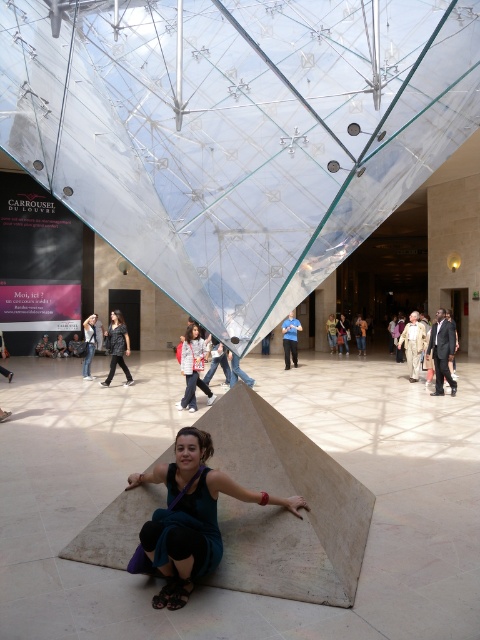
You are standing in the modern architectural space and want to place a small sculpture exactly halfway between the two points, point (189, 428) and point (213, 396). Which point is closer to you, and will the sculpture be placed closer to the viewer or further away?

Point (189, 428) is closer to the viewer than point (213, 396). The sculpture placed halfway between them will be positioned closer to the viewer than the farther point but still somewhere between the two distances.

You are a photographer planning to take a portrait of the woman wearing the teal fabric dress at center and the white shirt at center. Since both are sitting on the floor, which piece of clothing should you focus on first to ensure proper framing?

The teal fabric dress at center is shorter than the white shirt at center, so you should focus on the white shirt at center first as it is taller and more prominent in the frame.

You are a security guard in the museum and you see both the leather jacket at center and the blue shirt at center on the floor. Which item is larger?

The blue shirt at center is larger than the leather jacket at center.